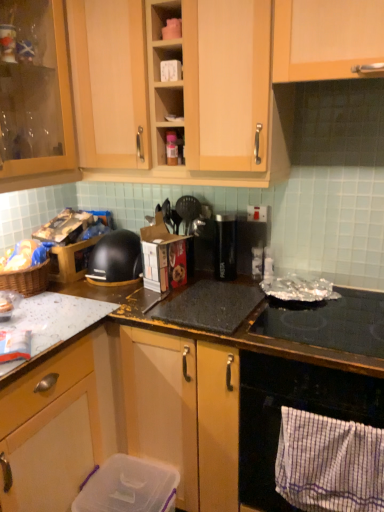
Locate an element on the screen. This screenshot has width=384, height=512. free space above black granite countertop at center (from a real-world perspective) is located at coordinates (239, 302).